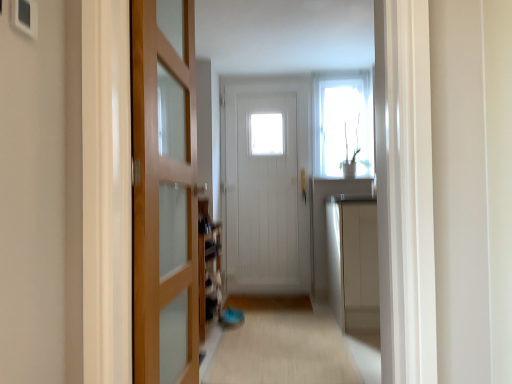
This screenshot has height=384, width=512. In order to click on vacant area situated below white wooden door at center, the first door from the right (from a real-world perspective) in this screenshot , I will do `click(261, 291)`.